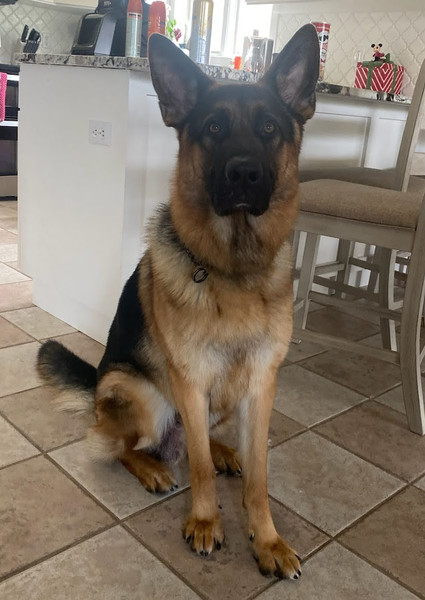
Image resolution: width=425 pixels, height=600 pixels. I want to click on leg chairs, so click(x=412, y=316), click(x=384, y=287), click(x=350, y=250), click(x=311, y=265).